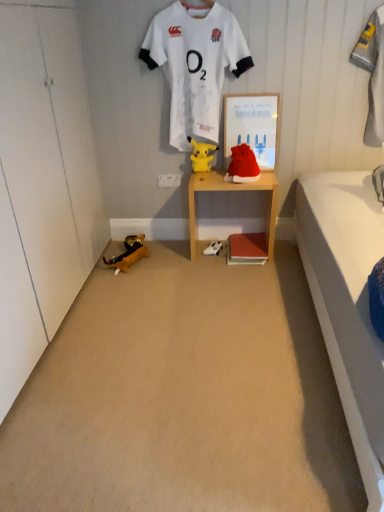
Identify the location of free point below red velvet santa hat at center, the 3th toy from the left (from a real-world perspective). (250, 174).